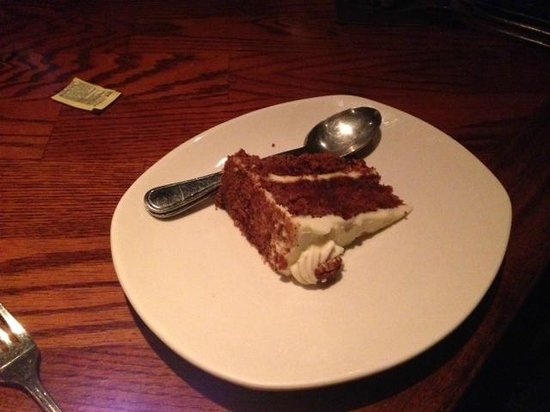
Locate an element on the screen. The width and height of the screenshot is (550, 412). spoon is located at coordinates (332, 134).